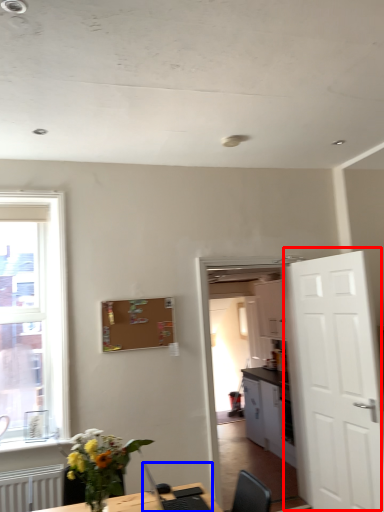
Question: Which of the following is the closest to the observer, door (highlighted by a red box) or computer (highlighted by a blue box)?

Choices:
 (A) door
 (B) computer

Answer: (B)